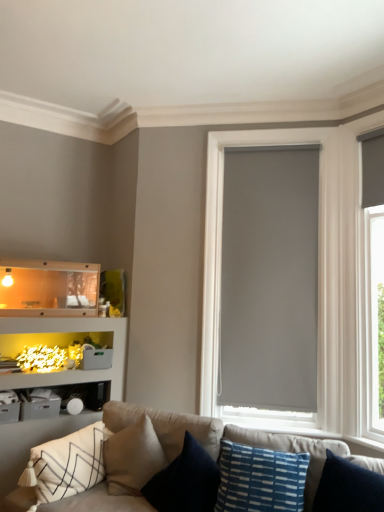
What is the approximate width of soft beige fabric couch at lower center?

32.54 inches.

Measure the distance between white textured pillow at lower left, positioned as the 3th pillow in right-to-left order, and camera.

white textured pillow at lower left, positioned as the 3th pillow in right-to-left order, and camera are 2.40 meters apart.

You are a GUI agent. You are given a task and a screenshot of the screen. Output one action in this format:
    pyautogui.click(x=<x>, y=<y>)
    Task: Click on the matte gray roller shade at center
    
    Given the screenshot: What is the action you would take?
    pyautogui.click(x=318, y=267)

Find the location of `dark blue textured pillow at center, which is counted as the second pillow, starting from the right`. dark blue textured pillow at center, which is counted as the second pillow, starting from the right is located at coordinates (185, 481).

At what (x,y) coordinates should I click in order to perform the action: click on soft beige fabric couch at lower center. Please return your answer as a coordinate pair (x, y). Image resolution: width=384 pixels, height=512 pixels. Looking at the image, I should click on (172, 462).

Starting from the matte gray roller shade at center, which pillow is the 2nd one in front? Please provide its 2D coordinates.

[(185, 481)]

Can you confirm if dark blue textured pillow at center, which is counted as the second pillow, starting from the right, is smaller than matte gray roller shade at center?

Yes.

Does point (205, 454) appear closer or farther from the camera than point (247, 134)?

Clearly, point (205, 454) is closer to the camera than point (247, 134).

From a real-world perspective, does dark blue textured pillow at center, which is counted as the second pillow, starting from the right, stand above matte gray roller shade at center?

No, from a real-world perspective, dark blue textured pillow at center, which is counted as the second pillow, starting from the right, is not on top of matte gray roller shade at center.

Does matte gray roller shade at center turn towards white textured pillow at lower left, which is counted as the first pillow, starting from the left?

No, matte gray roller shade at center is not turned towards white textured pillow at lower left, which is counted as the first pillow, starting from the left.

From a real-world perspective, who is located lower, matte gray roller shade at center or white textured pillow at lower left, positioned as the 3th pillow in right-to-left order?

In real-world perspective, white textured pillow at lower left, positioned as the 3th pillow in right-to-left order, is lower.

From the image's perspective, would you say matte gray roller shade at center is shown under white textured pillow at lower left, positioned as the 3th pillow in right-to-left order?

No, from the image's perspective, matte gray roller shade at center is not beneath white textured pillow at lower left, positioned as the 3th pillow in right-to-left order.

Considering the relative sizes of matte gray roller shade at center and white textured pillow at lower left, positioned as the 3th pillow in right-to-left order, in the image provided, is matte gray roller shade at center shorter than white textured pillow at lower left, positioned as the 3th pillow in right-to-left order,?

In fact, matte gray roller shade at center may be taller than white textured pillow at lower left, positioned as the 3th pillow in right-to-left order.

Which object is closer to the camera, white textured pillow at lower left, which is counted as the first pillow, starting from the left, or matte gray roller shade at center?

white textured pillow at lower left, which is counted as the first pillow, starting from the left, is closer to the camera.

Who is smaller, white textured pillow at lower left, which is counted as the first pillow, starting from the left, or matte gray roller shade at center?

Smaller between the two is white textured pillow at lower left, which is counted as the first pillow, starting from the left.

In the scene shown: Considering the positions of objects white textured pillow at lower left, which is counted as the first pillow, starting from the left, and matte gray roller shade at center in the image provided, who is more to the right, white textured pillow at lower left, which is counted as the first pillow, starting from the left, or matte gray roller shade at center?

From the viewer's perspective, matte gray roller shade at center appears more on the right side.

Does blue textured pillow at lower center, which is the third pillow in left-to-right order, come in front of white textured pillow at lower left, which is counted as the first pillow, starting from the left?

Yes, blue textured pillow at lower center, which is the third pillow in left-to-right order, is in front of white textured pillow at lower left, which is counted as the first pillow, starting from the left.

Which pillow is the 2nd one when counting from the front of the white textured pillow at lower left, positioned as the 3th pillow in right-to-left order? Please provide its 2D coordinates.

[(260, 479)]

Can you confirm if blue textured pillow at lower center, which is the third pillow in left-to-right order, is thinner than white textured pillow at lower left, positioned as the 3th pillow in right-to-left order?

Correct, the width of blue textured pillow at lower center, which is the third pillow in left-to-right order, is less than that of white textured pillow at lower left, positioned as the 3th pillow in right-to-left order.

Would you say blue textured pillow at lower center, which ranks as the 1th pillow in right-to-left order, is outside white textured pillow at lower left, which is counted as the first pillow, starting from the left?

Yes, blue textured pillow at lower center, which ranks as the 1th pillow in right-to-left order, is located beyond the bounds of white textured pillow at lower left, which is counted as the first pillow, starting from the left.

Does blue textured pillow at lower center, which is the third pillow in left-to-right order, appear on the right side of translucent plastic shelf at lower left?

Yes, blue textured pillow at lower center, which is the third pillow in left-to-right order, is to the right of translucent plastic shelf at lower left.

Does blue textured pillow at lower center, which ranks as the 1th pillow in right-to-left order, touch translucent plastic shelf at lower left?

blue textured pillow at lower center, which ranks as the 1th pillow in right-to-left order, and translucent plastic shelf at lower left are clearly separated.

Does blue textured pillow at lower center, which is the third pillow in left-to-right order, have a smaller size compared to translucent plastic shelf at lower left?

Indeed, blue textured pillow at lower center, which is the third pillow in left-to-right order, has a smaller size compared to translucent plastic shelf at lower left.

Can you confirm if blue textured pillow at lower center, which is the third pillow in left-to-right order, is shorter than translucent plastic shelf at lower left?

No.

Is white textured pillow at lower left, which is counted as the first pillow, starting from the left, to the left or to the right of translucent plastic shelf at lower left in the image?

Clearly, white textured pillow at lower left, which is counted as the first pillow, starting from the left, is on the right of translucent plastic shelf at lower left in the image.

Is white textured pillow at lower left, positioned as the 3th pillow in right-to-left order, positioned with its back to translucent plastic shelf at lower left?

No, white textured pillow at lower left, positioned as the 3th pillow in right-to-left order, is not facing the opposite direction of translucent plastic shelf at lower left.

From a real-world perspective, is white textured pillow at lower left, which is counted as the first pillow, starting from the left, positioned above or below translucent plastic shelf at lower left?

From a real-world perspective, white textured pillow at lower left, which is counted as the first pillow, starting from the left, is physically below translucent plastic shelf at lower left.

Is white textured pillow at lower left, which is counted as the first pillow, starting from the left, bigger or smaller than translucent plastic shelf at lower left?

In the image, white textured pillow at lower left, which is counted as the first pillow, starting from the left, appears to be smaller than translucent plastic shelf at lower left.

Is point (206, 174) closer to viewer compared to point (236, 463)?

No, it is not.

Is matte gray roller shade at center oriented away from blue textured pillow at lower center, which ranks as the 1th pillow in right-to-left order?

No, matte gray roller shade at center is not facing the opposite direction of blue textured pillow at lower center, which ranks as the 1th pillow in right-to-left order.

Considering the positions of objects matte gray roller shade at center and blue textured pillow at lower center, which is the third pillow in left-to-right order, in the image provided, who is more to the left, matte gray roller shade at center or blue textured pillow at lower center, which is the third pillow in left-to-right order,?

Positioned to the left is blue textured pillow at lower center, which is the third pillow in left-to-right order.

How many degrees apart are the facing directions of matte gray roller shade at center and blue textured pillow at lower center, which is the third pillow in left-to-right order?

The facing directions of matte gray roller shade at center and blue textured pillow at lower center, which is the third pillow in left-to-right order, are 15.2 degrees apart.

The image size is (384, 512). In order to click on pillow that is the 2nd object to the left of the matte gray roller shade at center, starting at the anchor in this screenshot , I will do `click(185, 481)`.

Where is `window above the white textured pillow at lower left, positioned as the 3th pillow in right-to-left order (from a real-world perspective)`? This screenshot has width=384, height=512. window above the white textured pillow at lower left, positioned as the 3th pillow in right-to-left order (from a real-world perspective) is located at coordinates tap(318, 267).

Estimate the real-world distances between objects in this image. Which object is further from soft beige fabric couch at lower center, matte gray roller shade at center or translucent plastic shelf at lower left?

translucent plastic shelf at lower left.

When comparing their distances from soft beige fabric couch at lower center, does blue textured pillow at lower center, which ranks as the 1th pillow in right-to-left order, or translucent plastic shelf at lower left seem further?

translucent plastic shelf at lower left is positioned further to the anchor soft beige fabric couch at lower center.

Considering their positions, is translucent plastic shelf at lower left positioned closer to blue textured pillow at lower center, which ranks as the 1th pillow in right-to-left order, than dark blue textured pillow at center, which is counted as the second pillow, starting from the right?

Among the two, dark blue textured pillow at center, which is counted as the second pillow, starting from the right, is located nearer to blue textured pillow at lower center, which ranks as the 1th pillow in right-to-left order.

Which object lies further to the anchor point blue textured pillow at lower center, which is the third pillow in left-to-right order, dark blue textured pillow at center, positioned as the 2th pillow in left-to-right order, or matte gray roller shade at center?

matte gray roller shade at center is positioned further to the anchor blue textured pillow at lower center, which is the third pillow in left-to-right order.

Looking at the image, which one is located closer to dark blue textured pillow at center, positioned as the 2th pillow in left-to-right order, blue textured pillow at lower center, which is the third pillow in left-to-right order, or white textured pillow at lower left, which is counted as the first pillow, starting from the left?

blue textured pillow at lower center, which is the third pillow in left-to-right order, is positioned closer to the anchor dark blue textured pillow at center, positioned as the 2th pillow in left-to-right order.

Which object lies further to the anchor point soft beige fabric couch at lower center, blue textured pillow at lower center, which ranks as the 1th pillow in right-to-left order, or dark blue textured pillow at center, positioned as the 2th pillow in left-to-right order?

Among the two, blue textured pillow at lower center, which ranks as the 1th pillow in right-to-left order, is located further to soft beige fabric couch at lower center.

Based on their spatial positions, is translucent plastic shelf at lower left or dark blue textured pillow at center, positioned as the 2th pillow in left-to-right order, closer to white textured pillow at lower left, which is counted as the first pillow, starting from the left?

Based on the image, dark blue textured pillow at center, positioned as the 2th pillow in left-to-right order, appears to be nearer to white textured pillow at lower left, which is counted as the first pillow, starting from the left.

Based on their spatial positions, is translucent plastic shelf at lower left or matte gray roller shade at center closer to dark blue textured pillow at center, which is counted as the second pillow, starting from the right?

matte gray roller shade at center is closer to dark blue textured pillow at center, which is counted as the second pillow, starting from the right.

Identify the location of pillow between matte gray roller shade at center and dark blue textured pillow at center, which is counted as the second pillow, starting from the right, from top to bottom. (260, 479).

This screenshot has height=512, width=384. In order to click on studio couch situated between translucent plastic shelf at lower left and matte gray roller shade at center from left to right in this screenshot , I will do `click(172, 462)`.

Identify the location of studio couch situated between translucent plastic shelf at lower left and blue textured pillow at lower center, which is the third pillow in left-to-right order, from left to right. (172, 462).

This screenshot has width=384, height=512. In order to click on studio couch located between white textured pillow at lower left, positioned as the 3th pillow in right-to-left order, and dark blue textured pillow at center, positioned as the 2th pillow in left-to-right order, in the left-right direction in this screenshot , I will do `click(172, 462)`.